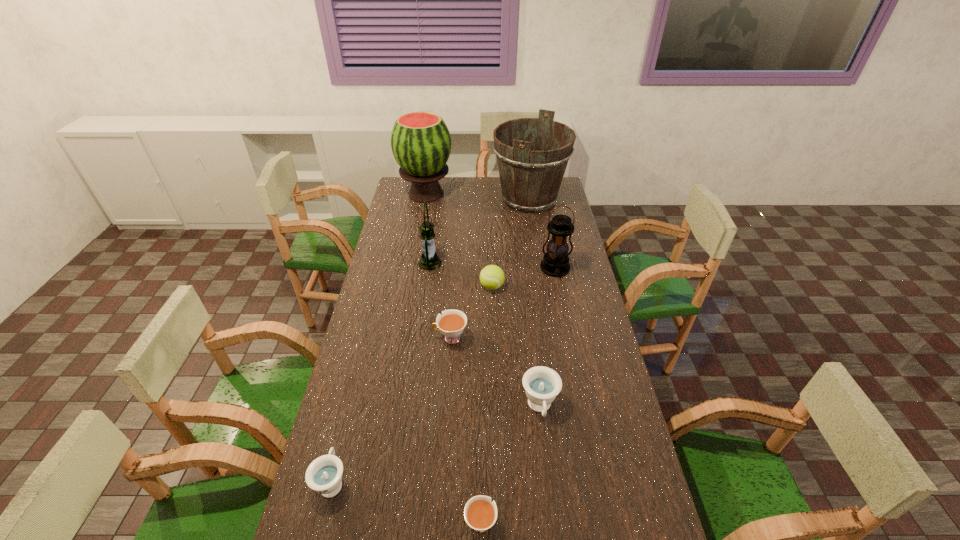
Image resolution: width=960 pixels, height=540 pixels. Identify the location of vacant region located 0.340m on the side of the nearer blue teacup with the handle. (363, 361).

This screenshot has height=540, width=960. Find the location of `free space located on the side of the nearer blue teacup with the handle`. free space located on the side of the nearer blue teacup with the handle is located at coordinates (361, 368).

At what (x,y) coordinates should I click in order to perform the action: click on bucket present at the far edge. Please return your answer as a coordinate pair (x, y). Looking at the image, I should click on (532, 154).

This screenshot has height=540, width=960. Find the location of `watermelon located in the far edge section of the desktop`. watermelon located in the far edge section of the desktop is located at coordinates (421, 144).

The height and width of the screenshot is (540, 960). In order to click on watermelon present at the left edge in this screenshot , I will do `click(421, 144)`.

At what (x,y) coordinates should I click in order to perform the action: click on teacup at the left edge. Please return your answer as a coordinate pair (x, y). Looking at the image, I should click on (324, 475).

The image size is (960, 540). Find the location of `bucket that is at the right edge`. bucket that is at the right edge is located at coordinates (532, 154).

Where is `lantern present at the right edge`? lantern present at the right edge is located at coordinates (555, 263).

At what (x,y) coordinates should I click in order to perform the action: click on object present at the far left corner. Please return your answer as a coordinate pair (x, y). The height and width of the screenshot is (540, 960). Looking at the image, I should click on (421, 144).

Where is `object that is at the far right corner`? object that is at the far right corner is located at coordinates (532, 154).